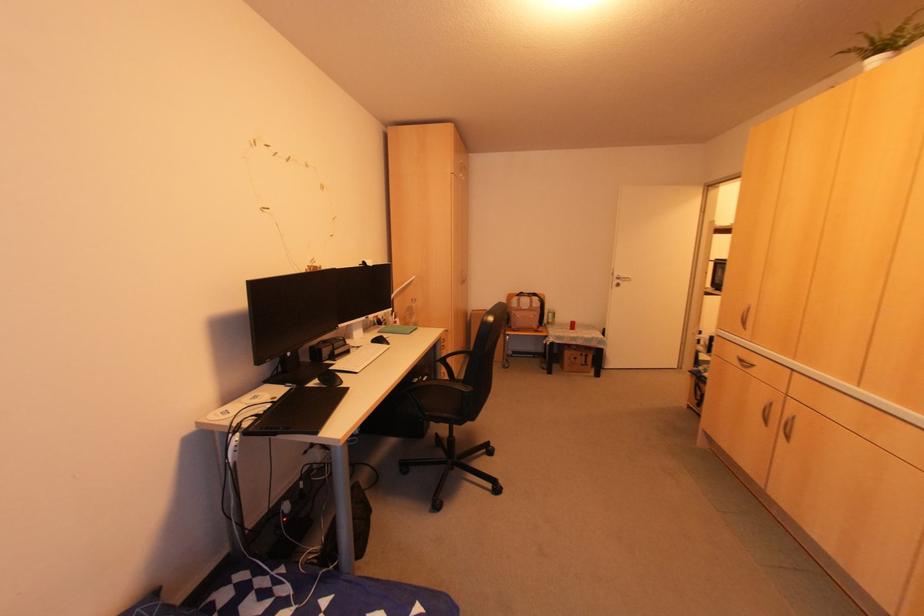
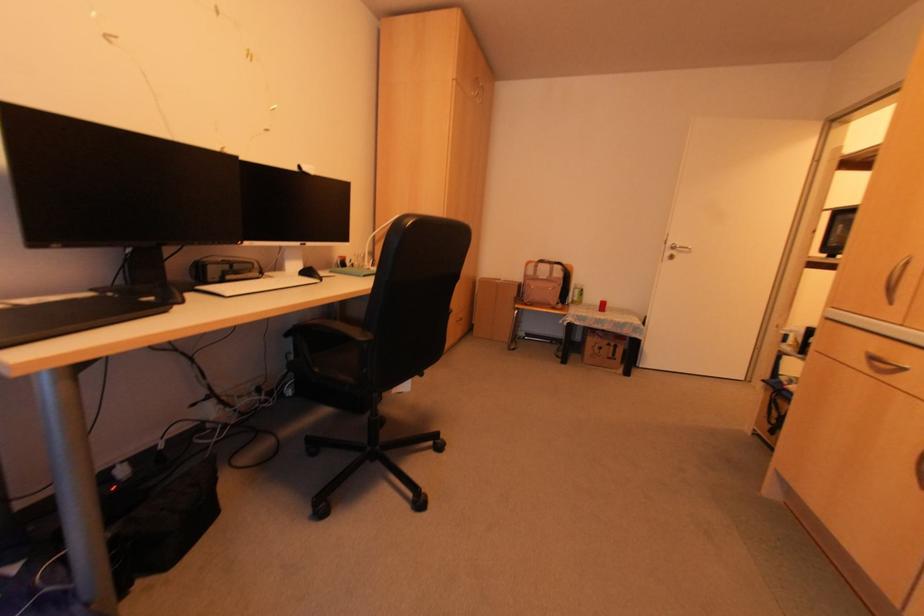
The point at (750, 367) is marked in the first image. Where is the corresponding point in the second image?

(906, 371)